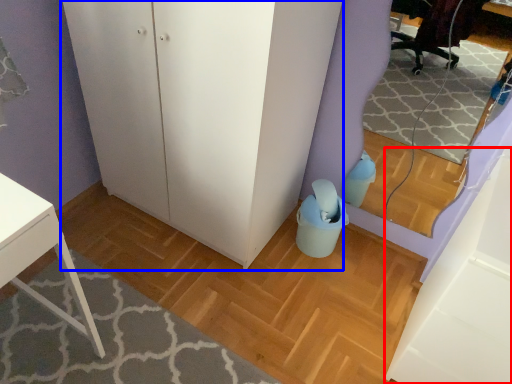
Question: Which point is further to the camera, cabinetry (highlighted by a red box) or dresser (highlighted by a blue box)?

Choices:
 (A) cabinetry
 (B) dresser

Answer: (B)